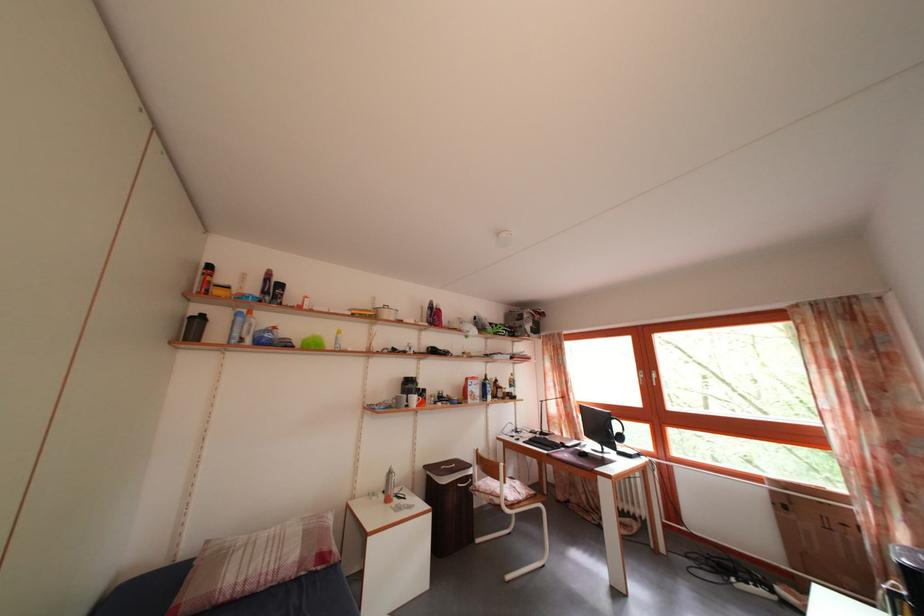
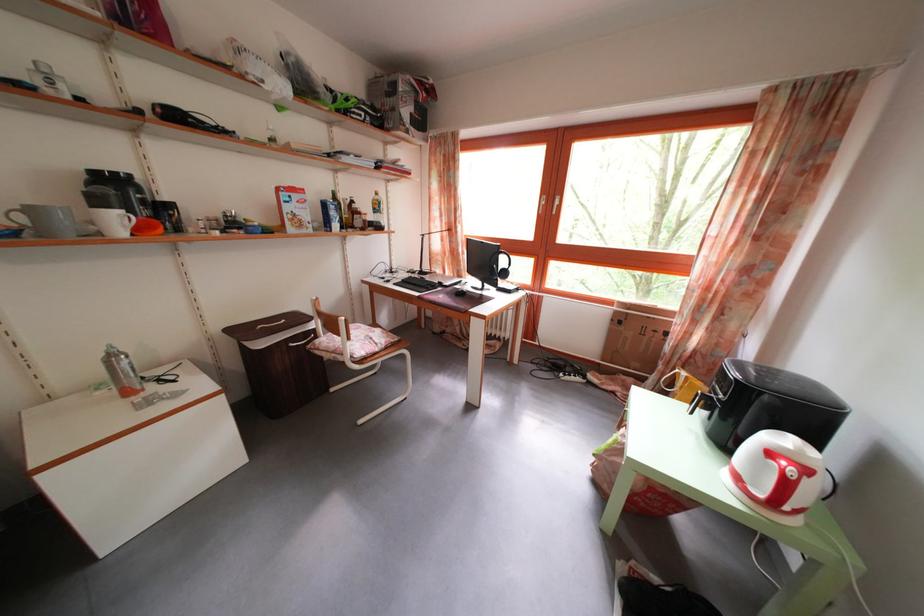
In the second image, find the point that corresponds to (479,484) in the first image.

(322, 339)